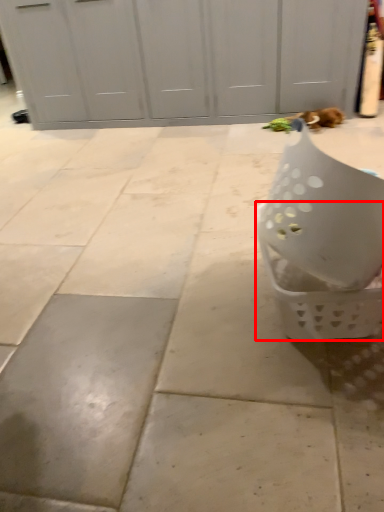
Question: In this image, where is basket (annotated by the red box) located relative to cat?

Choices:
 (A) right
 (B) left

Answer: (B)